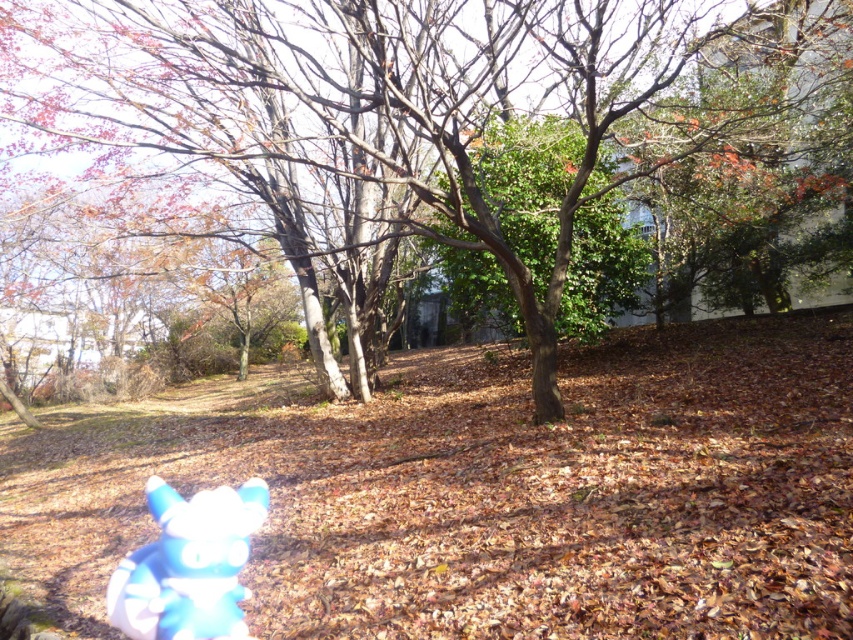
Question: Considering the relative positions of brown matte tree at center and blue plush toy at lower left in the image provided, where is brown matte tree at center located with respect to blue plush toy at lower left?

Choices:
 (A) above
 (B) below

Answer: (A)

Question: Does brown matte tree at center have a smaller size compared to blue plush toy at lower left?

Choices:
 (A) yes
 (B) no

Answer: (B)

Question: Does brown matte tree at center appear over blue plush toy at lower left?

Choices:
 (A) no
 (B) yes

Answer: (B)

Question: Which of the following is the closest to the observer?

Choices:
 (A) blue plush toy at lower left
 (B) brown matte tree at center

Answer: (A)

Question: Which point is closer to the camera?

Choices:
 (A) click(x=129, y=579)
 (B) click(x=479, y=51)

Answer: (A)